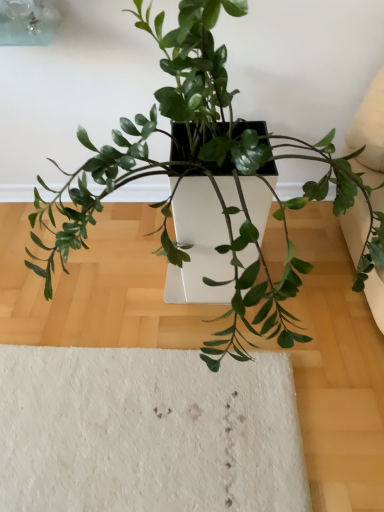
You are a GUI agent. You are given a task and a screenshot of the screen. Output one action in this format:
    pyautogui.click(x=<x>, y=<y>)
    Task: Click on the green glossy plant at center
    
    Given the screenshot: What is the action you would take?
    pyautogui.click(x=207, y=176)

The image size is (384, 512). What do you see at coordinates (207, 176) in the screenshot?
I see `green glossy plant at center` at bounding box center [207, 176].

Identify the location of green glossy plant at center. This screenshot has height=512, width=384. (207, 176).